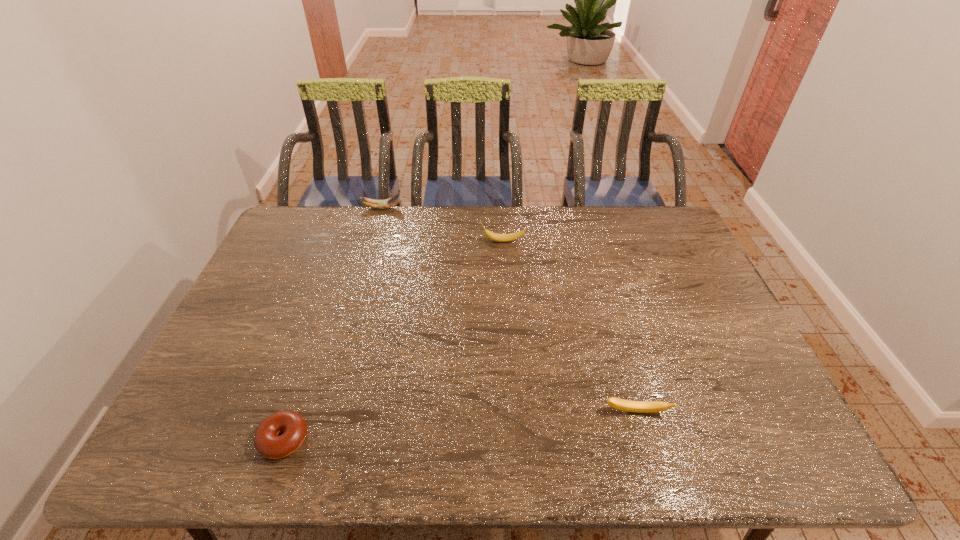
Locate an element on the screen. the farthest object is located at coordinates [393, 201].

At what (x,y) coordinates should I click in order to perform the action: click on the leftmost banana. Please return your answer as a coordinate pair (x, y). The width and height of the screenshot is (960, 540). Looking at the image, I should click on (393, 201).

In order to click on the second shortest banana in this screenshot , I will do `click(492, 236)`.

Image resolution: width=960 pixels, height=540 pixels. I want to click on the second banana from left to right, so click(x=492, y=236).

Identify the location of the rightmost banana. The width and height of the screenshot is (960, 540). (625, 405).

Image resolution: width=960 pixels, height=540 pixels. In order to click on the nearest banana in this screenshot , I will do `click(625, 405)`.

You are a GUI agent. You are given a task and a screenshot of the screen. Output one action in this format:
    pyautogui.click(x=<x>, y=<y>)
    Task: Click on the doughnut
    
    Given the screenshot: What is the action you would take?
    pyautogui.click(x=267, y=442)

At what (x,y) coordinates should I click in order to perform the action: click on free space located on the peel of the farthest object. Please return your answer as a coordinate pair (x, y). The width and height of the screenshot is (960, 540). Looking at the image, I should click on (420, 208).

I want to click on blank space located 0.360m at the stem of the second tallest object, so click(375, 241).

Where is `vacant space located 0.380m at the stem of the second tallest object`? The width and height of the screenshot is (960, 540). vacant space located 0.380m at the stem of the second tallest object is located at coordinates (370, 241).